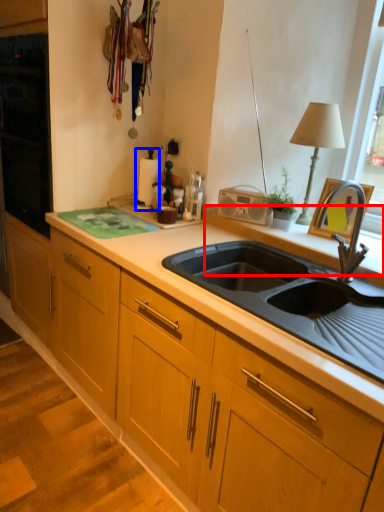
Question: Which object appears farthest to the camera in this image, window sill (highlighted by a red box) or appliance (highlighted by a blue box)?

Choices:
 (A) window sill
 (B) appliance

Answer: (B)